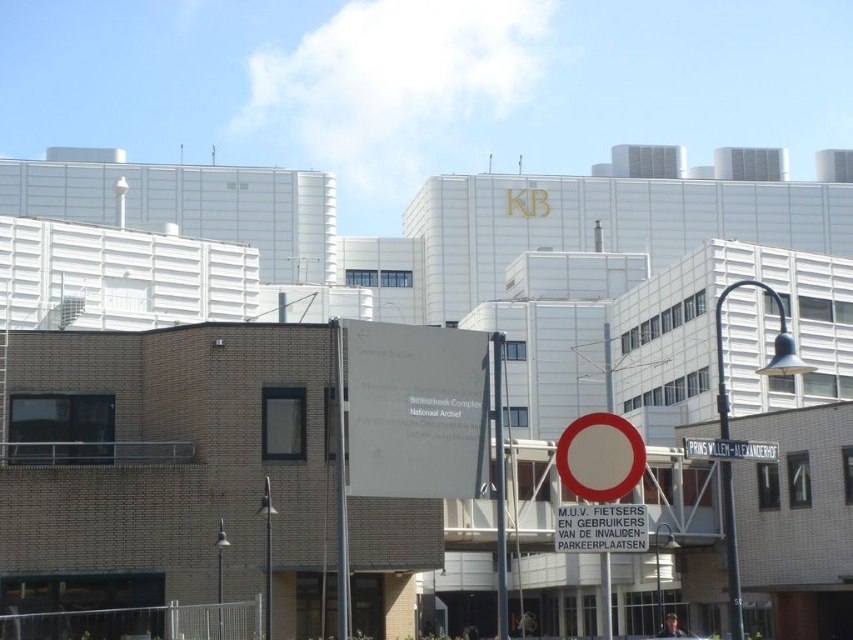
You are a city planner analyzing the urban layout. You notice a metallic pole at center and a red circle sign at center. Which object occupies more space in the scene?

The metallic pole at center is bigger than the red circle sign at center, so it occupies more space in the scene.